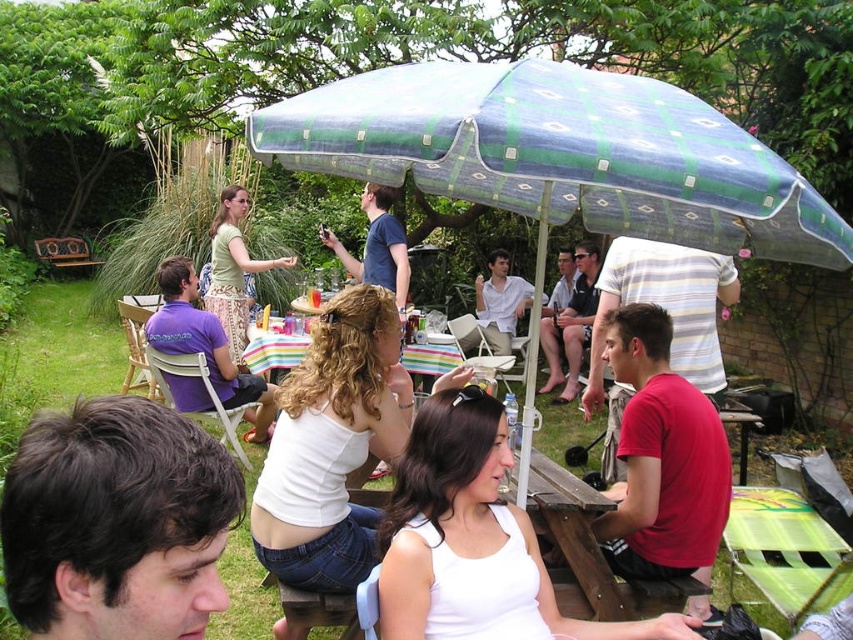
Does purple cotton shirt at left come behind matte blue shirt at center?

No.

You are a GUI agent. You are given a task and a screenshot of the screen. Output one action in this format:
    pyautogui.click(x=<x>, y=<y>)
    Task: Click on the purple cotton shirt at left
    This screenshot has width=853, height=640.
    Given the screenshot: What is the action you would take?
    pyautogui.click(x=206, y=342)

Is point (152, 316) more distant than point (373, 218)?

No.

Locate an element on the screen. The width and height of the screenshot is (853, 640). purple cotton shirt at left is located at coordinates (206, 342).

How much distance is there between red matte shirt at lower right and purple cotton shirt at left?

red matte shirt at lower right and purple cotton shirt at left are 2.78 meters apart.

Which is in front, point (660, 422) or point (196, 342)?

Point (660, 422)

Image resolution: width=853 pixels, height=640 pixels. In order to click on red matte shirt at lower right in this screenshot , I will do `click(662, 458)`.

Is dark brown hair at center closer to the viewer compared to red matte shirt at lower right?

Yes, dark brown hair at center is in front of red matte shirt at lower right.

Find the location of a particular element. This screenshot has height=640, width=853. dark brown hair at center is located at coordinates (115, 522).